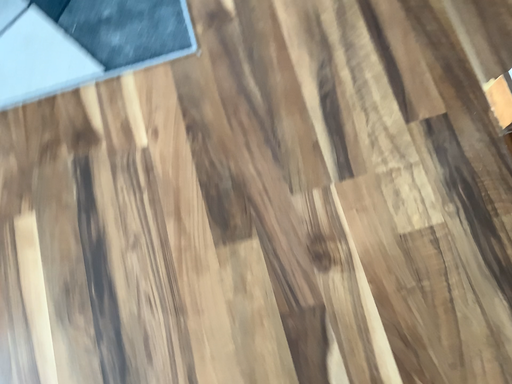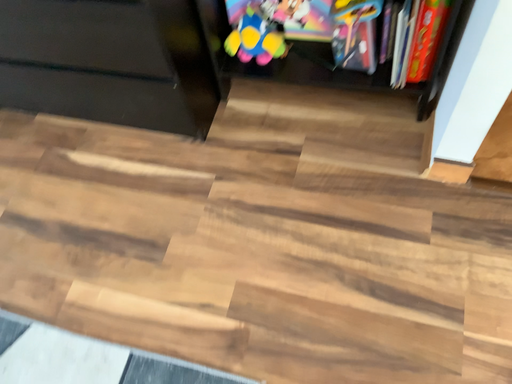
Question: Which way did the camera rotate in the video?

Choices:
 (A) rotated downward
 (B) rotated upward

Answer: (B)